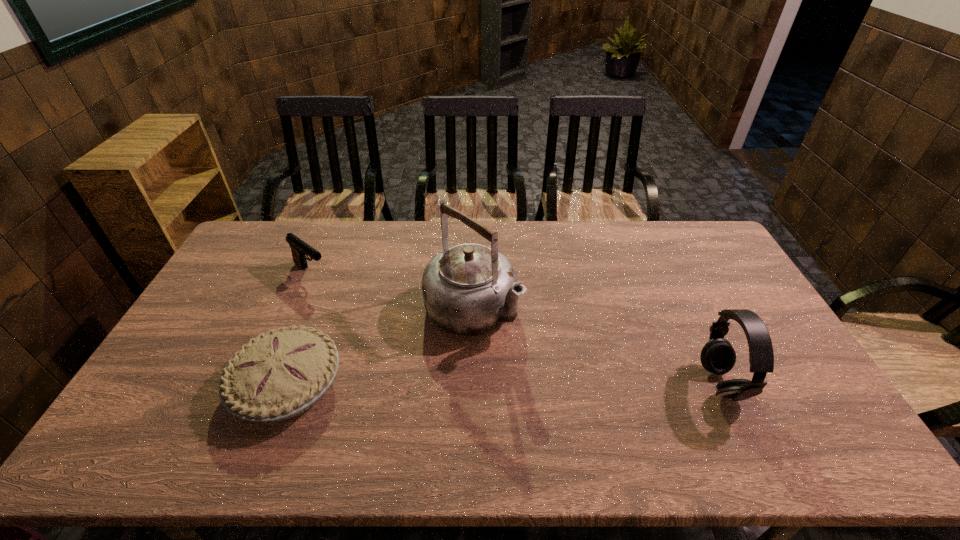
Locate an element on the screen. free space between the tallest object and the earphone is located at coordinates (596, 347).

Find the location of a particular element. free space between the second tallest object and the tallest object is located at coordinates (596, 347).

This screenshot has width=960, height=540. I want to click on free area in between the shortest object and the kettle, so click(x=380, y=347).

At what (x,y) coordinates should I click in order to perform the action: click on object that can be found as the closest to the third object from left to right. Please return your answer as a coordinate pair (x, y). The image size is (960, 540). Looking at the image, I should click on (278, 375).

Locate which object is the closest to the pie. Please provide its 2D coordinates. Your answer should be formatted as a tuple, i.e. [(x, y)], where the tuple contains the x and y coordinates of a point satisfying the conditions above.

[(470, 289)]

In order to click on vacant space that satisfies the following two spatial constraints: 1. on the back side of the third object from left to right; 2. on the left side of the pie in this screenshot , I will do `click(316, 310)`.

The height and width of the screenshot is (540, 960). What are the coordinates of `free spot that satisfies the following two spatial constraints: 1. on the front side of the tallest object; 2. on the ear cups of the earphone` in the screenshot? It's located at (471, 383).

This screenshot has width=960, height=540. I want to click on vacant space that satisfies the following two spatial constraints: 1. on the back side of the pie; 2. on the ear cups of the rightmost object, so click(x=288, y=383).

Where is `blank area in the image that satisfies the following two spatial constraints: 1. on the back side of the pie; 2. on the ear cups of the third shortest object`? This screenshot has width=960, height=540. blank area in the image that satisfies the following two spatial constraints: 1. on the back side of the pie; 2. on the ear cups of the third shortest object is located at coordinates (288, 383).